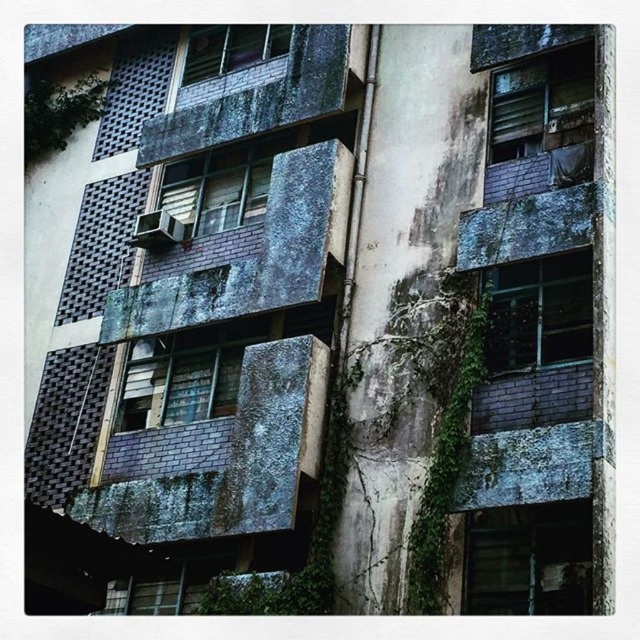
Based on the photo, you are standing in front of the building and notice both the matte glass window at center and the matte gray concrete balcony at upper center. Which object is closer to you?

The matte glass window at center is closer to you because it is in front of the matte gray concrete balcony at upper center.

You are a window installer assessing the building facade. You need to place a new air conditioning unit on the matte glass window at upper center. Based on the building description, is there already an air conditioning unit on this window?

The description mentions that some windows have air conditioning units installed, but it does not specify whether the matte glass window at upper center has one. Therefore, you cannot confirm if an AC unit is already present on this window.